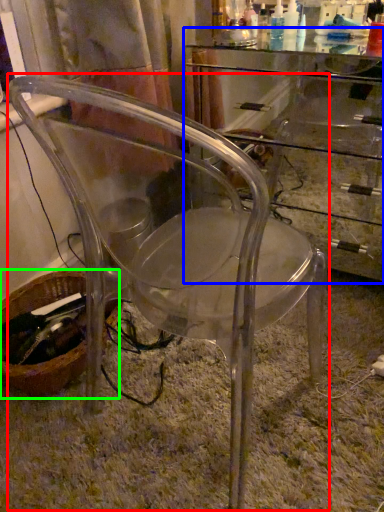
Question: Based on their relative distances, which object is nearer to chair (highlighted by a red box)? Choose from computer desk (highlighted by a blue box) and basket (highlighted by a green box).

Choices:
 (A) computer desk
 (B) basket

Answer: (B)